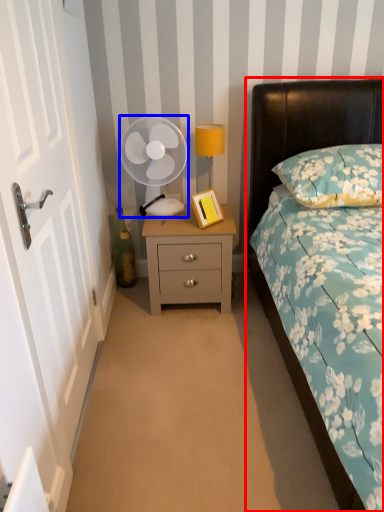
Question: Among these objects, which one is nearest to the camera, bed (highlighted by a red box) or mechanical fan (highlighted by a blue box)?

Choices:
 (A) bed
 (B) mechanical fan

Answer: (A)